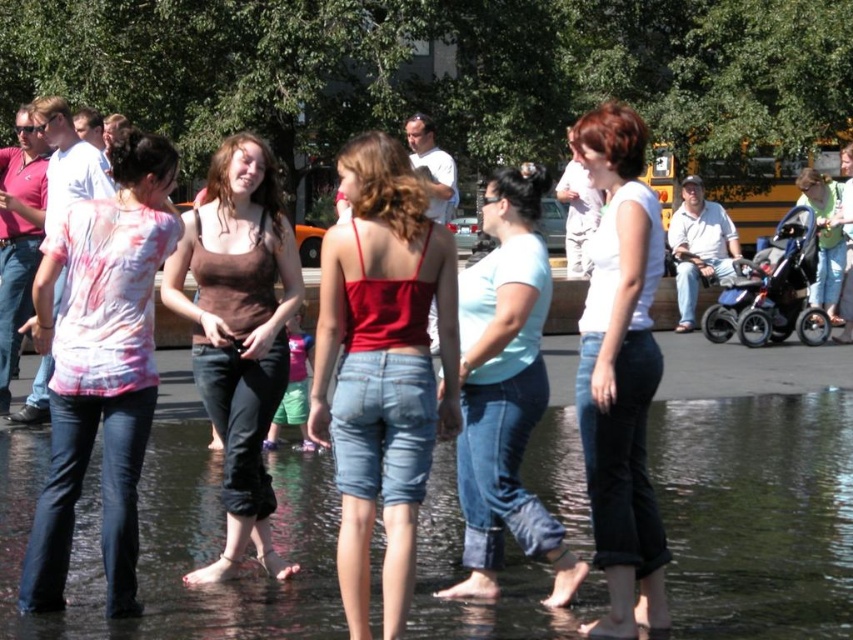
Question: Among these objects, which one is farthest from the camera?

Choices:
 (A) brown cotton tank top at center
 (B) tie-dye cotton shirt at left

Answer: (A)

Question: Which point is closer to the camera?

Choices:
 (A) 630,294
 (B) 805,184
 (C) 117,488

Answer: (A)

Question: Can you confirm if clear water at center is positioned above light green cotton shirt at center?

Choices:
 (A) no
 (B) yes

Answer: (A)

Question: From the image, what is the correct spatial relationship of matte red tank top at center in relation to tie-dye cotton shirt at left?

Choices:
 (A) right
 (B) left

Answer: (A)

Question: Can you confirm if matte red tank top at center is positioned to the right of brown cotton tank top at center?

Choices:
 (A) no
 (B) yes

Answer: (B)

Question: Which object appears farthest from the camera in this image?

Choices:
 (A) light blue denim jeans at center
 (B) tie-dye cotton shirt at left
 (C) matte red tank top at center
 (D) light green cotton shirt at center

Answer: (D)